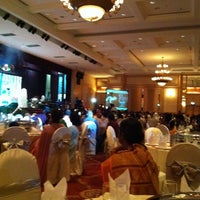
I want to click on chandelier, so (162, 73), (99, 17).